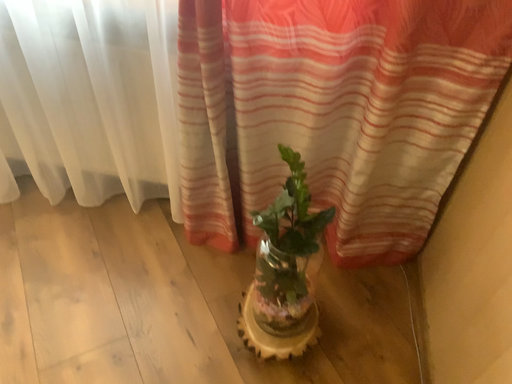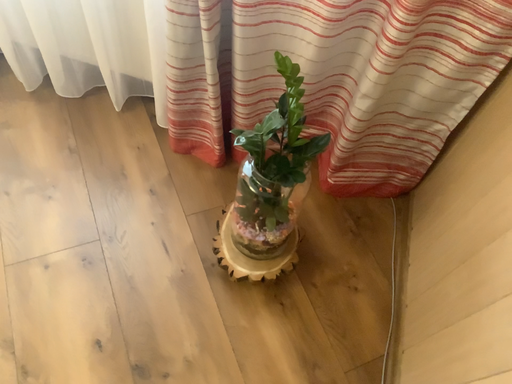
Question: Which way did the camera rotate in the video?

Choices:
 (A) rotated upward
 (B) rotated downward

Answer: (B)